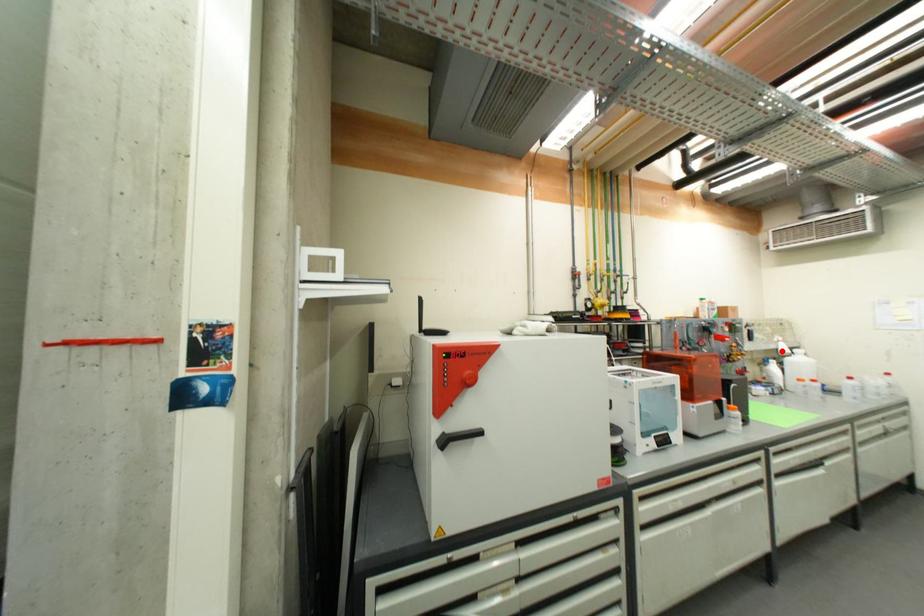
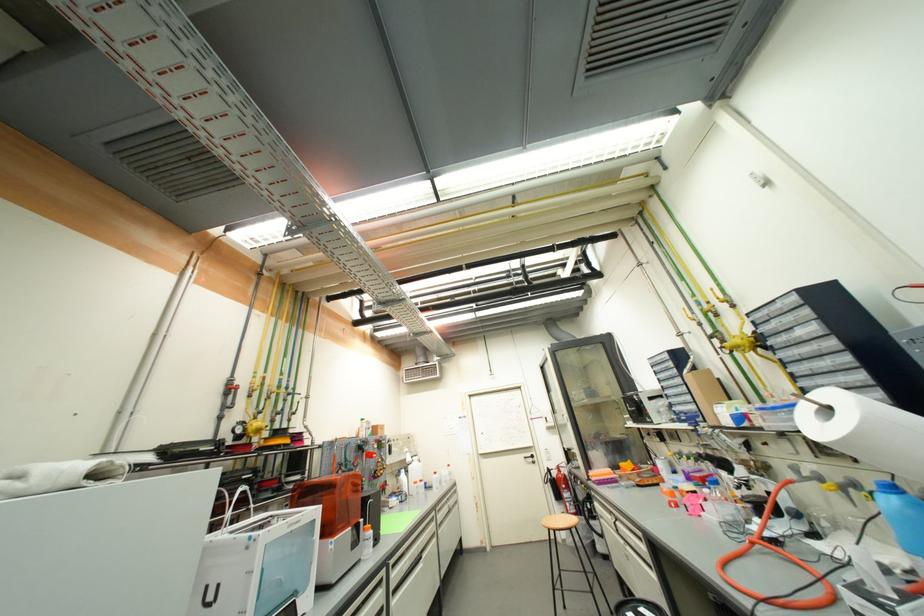
The point at the highlighted location is marked in the first image. Where is the corresponding point in the second image?

(410, 461)